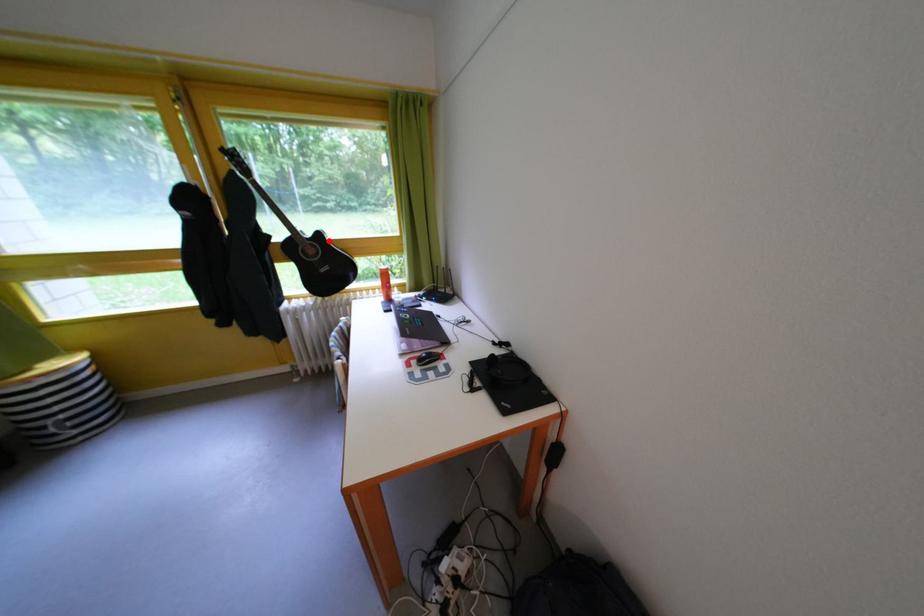
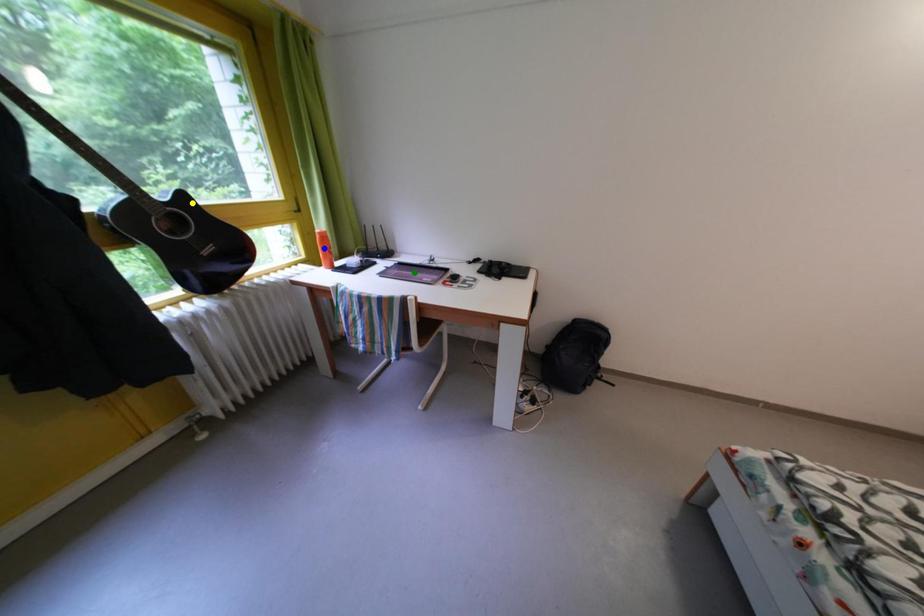
Question: I am providing you with two images of the same scene from different viewpoints. A red point is marked on the first image. You are given multiple points on the second image. Which mark in image 2 goes with the point in image 1?

Choices:
 (A) yellow point
 (B) blue point
 (C) green point

Answer: (A)